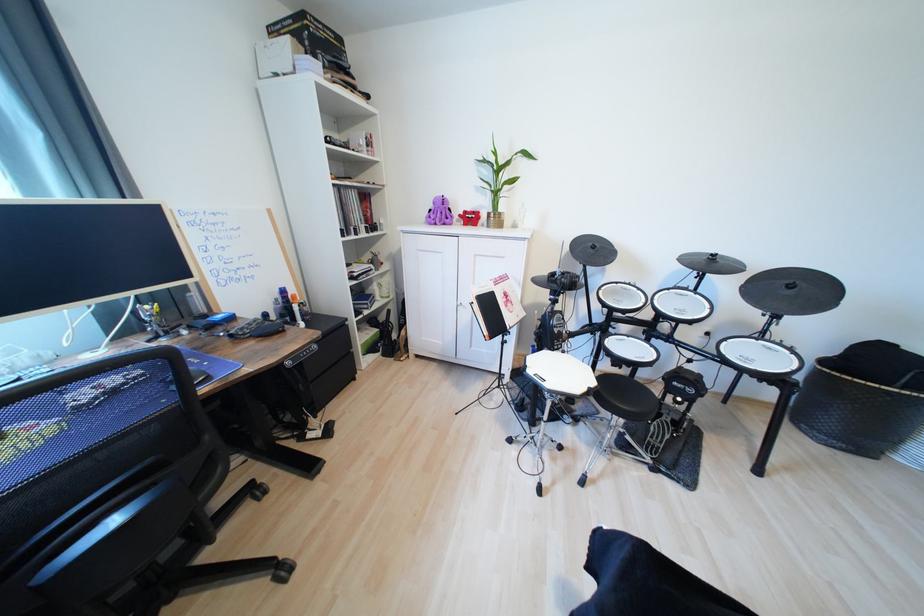
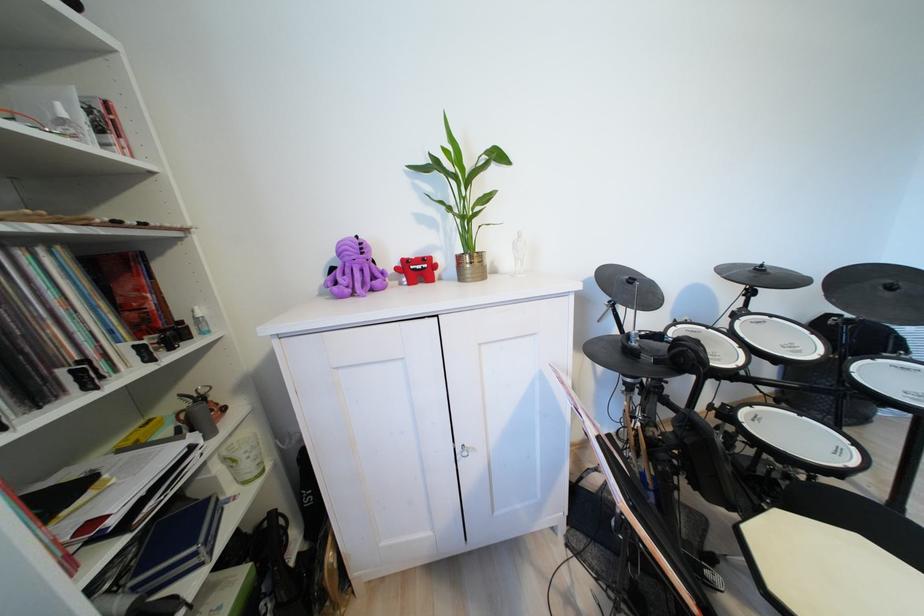
Where in the second image is the point corresponding to the point at 797,288 from the first image?

(897, 289)